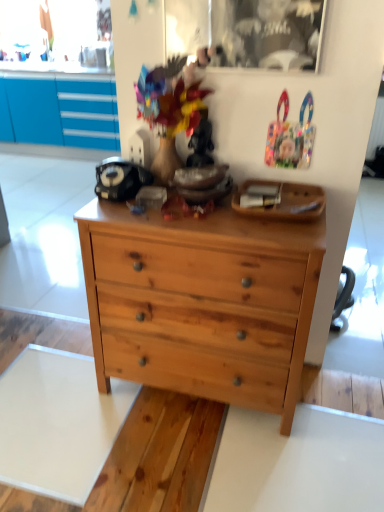
Question: Is wooden tray at upper center to the left of transparent glass picture frame at upper center from the viewer's perspective?

Choices:
 (A) no
 (B) yes

Answer: (A)

Question: Considering the relative sizes of wooden tray at upper center and transparent glass picture frame at upper center in the image provided, is wooden tray at upper center thinner than transparent glass picture frame at upper center?

Choices:
 (A) yes
 (B) no

Answer: (B)

Question: Is wooden tray at upper center positioned beyond the bounds of transparent glass picture frame at upper center?

Choices:
 (A) yes
 (B) no

Answer: (A)

Question: Considering the relative sizes of wooden tray at upper center and transparent glass picture frame at upper center in the image provided, is wooden tray at upper center taller than transparent glass picture frame at upper center?

Choices:
 (A) yes
 (B) no

Answer: (B)

Question: Considering the relative sizes of wooden tray at upper center and transparent glass picture frame at upper center in the image provided, is wooden tray at upper center bigger than transparent glass picture frame at upper center?

Choices:
 (A) no
 (B) yes

Answer: (B)

Question: Is wooden tray at upper center wider or thinner than natural wood chest of drawers at center?

Choices:
 (A) thin
 (B) wide

Answer: (A)

Question: In the image, is wooden tray at upper center positioned in front of or behind natural wood chest of drawers at center?

Choices:
 (A) front
 (B) behind

Answer: (B)

Question: From the image's perspective, is wooden tray at upper center above or below natural wood chest of drawers at center?

Choices:
 (A) above
 (B) below

Answer: (A)

Question: Is wooden tray at upper center bigger or smaller than natural wood chest of drawers at center?

Choices:
 (A) small
 (B) big

Answer: (A)

Question: In terms of width, does transparent glass picture frame at upper center look wider or thinner when compared to wooden tray at upper center?

Choices:
 (A) thin
 (B) wide

Answer: (A)

Question: Considering the positions of transparent glass picture frame at upper center and wooden tray at upper center in the image, is transparent glass picture frame at upper center bigger or smaller than wooden tray at upper center?

Choices:
 (A) big
 (B) small

Answer: (B)

Question: Relative to wooden tray at upper center, is transparent glass picture frame at upper center in front or behind?

Choices:
 (A) behind
 (B) front

Answer: (A)

Question: From the image's perspective, is transparent glass picture frame at upper center above or below wooden tray at upper center?

Choices:
 (A) below
 (B) above

Answer: (B)

Question: In terms of size, does natural wood chest of drawers at center appear bigger or smaller than wooden tray at upper center?

Choices:
 (A) small
 (B) big

Answer: (B)

Question: From the image's perspective, is natural wood chest of drawers at center positioned above or below wooden tray at upper center?

Choices:
 (A) below
 (B) above

Answer: (A)